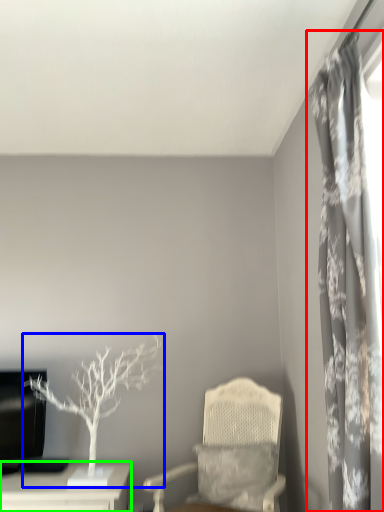
Question: Which object is the closest to the curtain (highlighted by a red box)? Choose among these: houseplant (highlighted by a blue box) or table (highlighted by a green box).

Choices:
 (A) houseplant
 (B) table

Answer: (A)